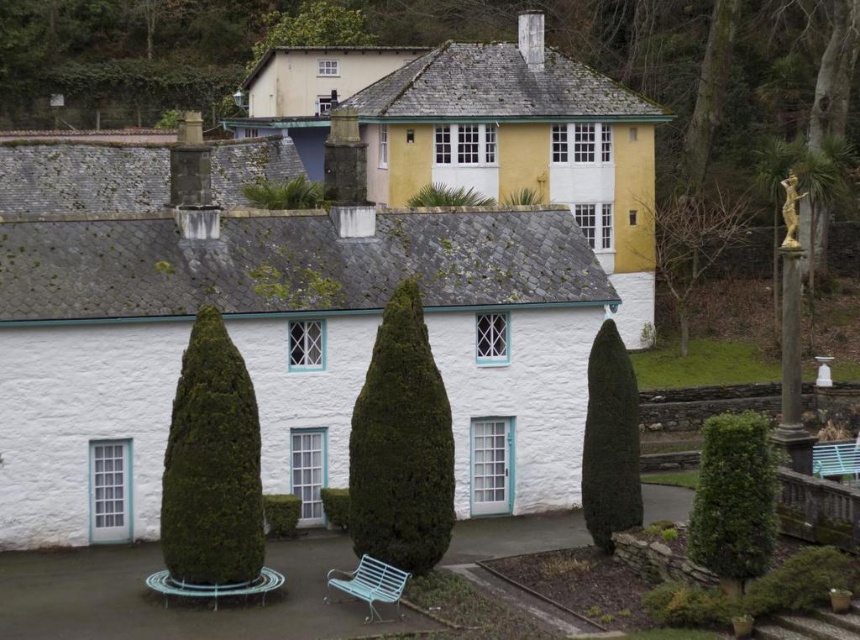
Which of these two, green textured hedge at center or white metal bench at lower center, stands taller?

Standing taller between the two is green textured hedge at center.

Which is behind, point (349, 468) or point (394, 600)?

Point (349, 468)

I want to click on green textured hedge at center, so click(x=401, y=445).

Does green leafy hedge at right appear on the left side of bare branches at right?

Indeed, green leafy hedge at right is positioned on the left side of bare branches at right.

Which is behind, point (760, 436) or point (717, 188)?

Positioned behind is point (717, 188).

Who is more distant from viewer, (713, 432) or (670, 227)?

The point (670, 227) is behind.

Locate an element on the screen. The height and width of the screenshot is (640, 860). green leafy hedge at right is located at coordinates (734, 499).

Between green textured hedge at center and bare branches at right, which one appears on the left side from the viewer's perspective?

Positioned to the left is green textured hedge at center.

Measure the distance between green textured hedge at center and camera.

green textured hedge at center and camera are 27.97 meters apart.

Where is `green textured hedge at center`? green textured hedge at center is located at coordinates (401, 445).